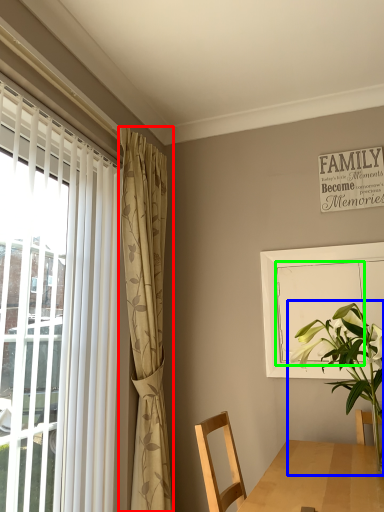
Question: Which object is positioned closest to curtain (highlighted by a red box)? Select from houseplant (highlighted by a blue box) and screen door (highlighted by a green box).

Choices:
 (A) houseplant
 (B) screen door

Answer: (B)